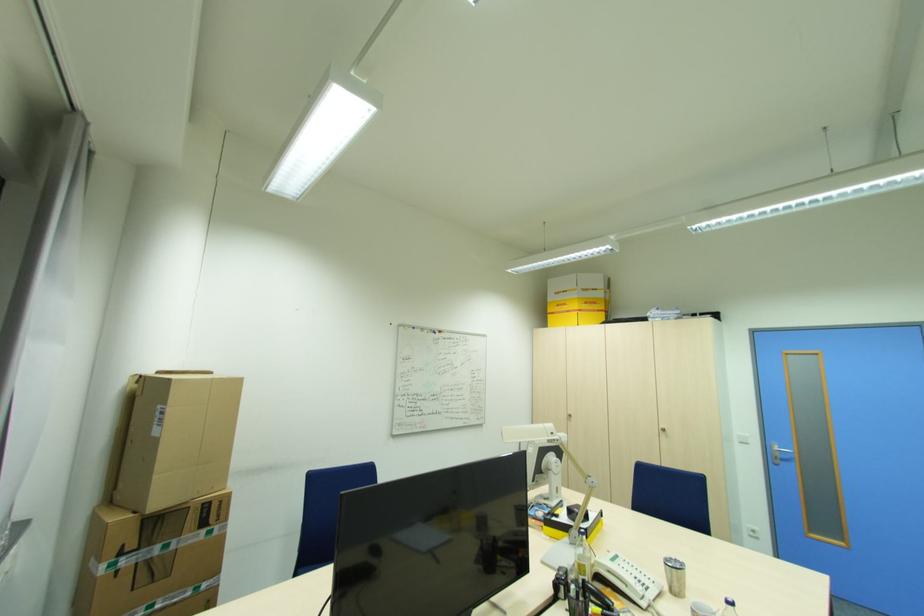
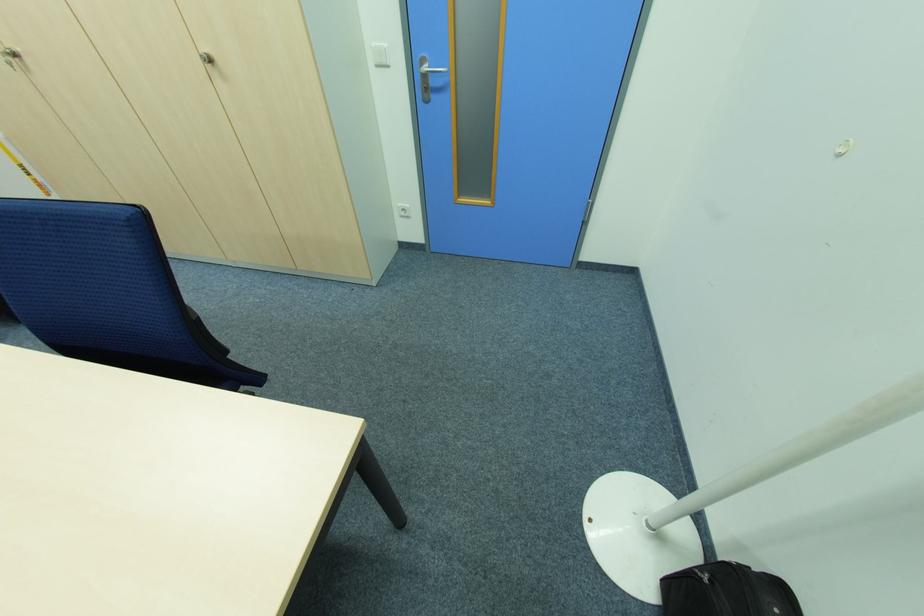
The point at (756,531) is marked in the first image. Where is the corresponding point in the second image?

(407, 209)